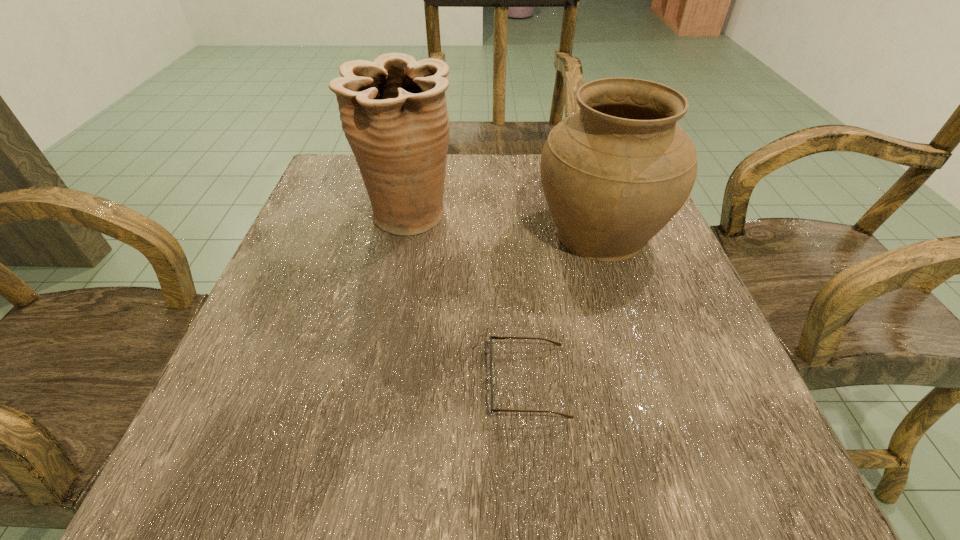
This screenshot has width=960, height=540. In order to click on object located in the right edge section of the desktop in this screenshot , I will do `click(614, 173)`.

This screenshot has width=960, height=540. What are the coordinates of `object located at the far left corner` in the screenshot? It's located at (393, 111).

Where is `object located in the far right corner section of the desktop`? This screenshot has width=960, height=540. object located in the far right corner section of the desktop is located at coordinates (614, 173).

At what (x,y) coordinates should I click in order to perform the action: click on vacant area at the far edge of the desktop. Please return your answer as a coordinate pair (x, y). Looking at the image, I should click on (462, 157).

Find the location of `vacant space at the near edge`. vacant space at the near edge is located at coordinates (522, 443).

The height and width of the screenshot is (540, 960). What are the coordinates of `vacant position at the left edge of the desktop` in the screenshot? It's located at (287, 422).

In the image, there is a desktop. In order to click on free space at the right edge in this screenshot , I will do pos(685,395).

I want to click on empty location between the right urn and the nearest object, so (x=564, y=307).

At what (x,y) coordinates should I click in order to perform the action: click on blank region between the leftmost object and the right urn. Please return your answer as a coordinate pair (x, y). Image resolution: width=960 pixels, height=540 pixels. Looking at the image, I should click on (505, 225).

I want to click on unoccupied position between the spectacles and the left urn, so click(469, 298).